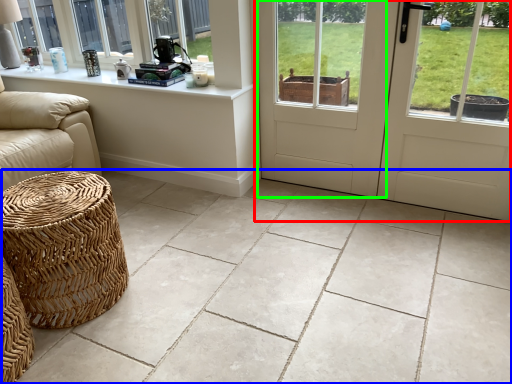
Question: Considering the real-world distances, which object is closest to door (highlighted by a red box)? ceramic tile (highlighted by a blue box) or screen door (highlighted by a green box).

Choices:
 (A) ceramic tile
 (B) screen door

Answer: (B)